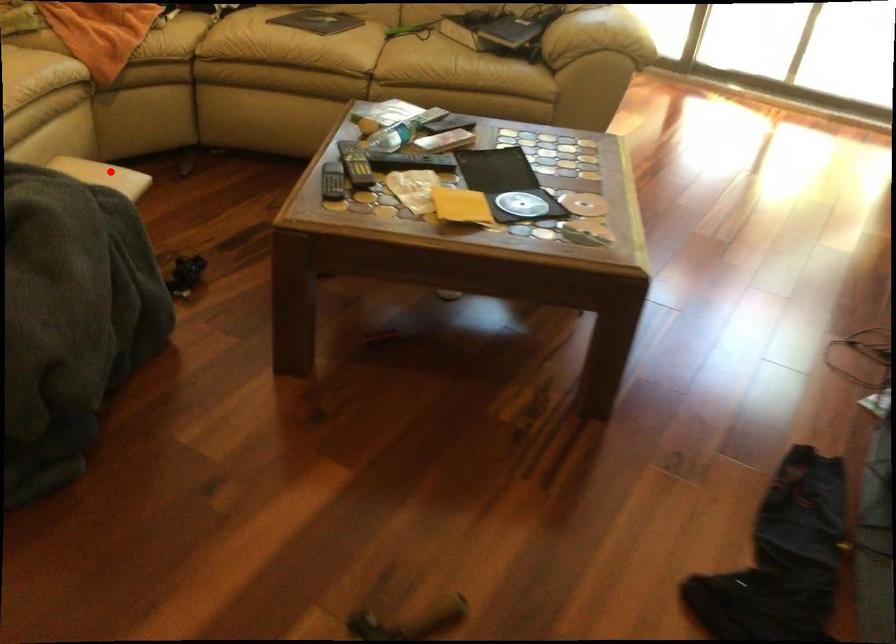
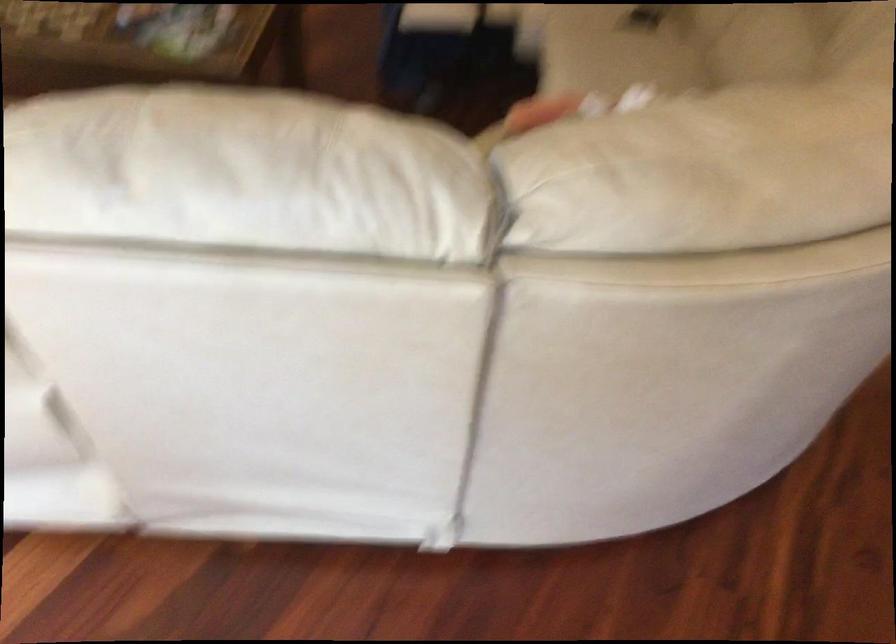
Find the pixel in the second image that matches the highlighted location in the first image.

(437, 17)